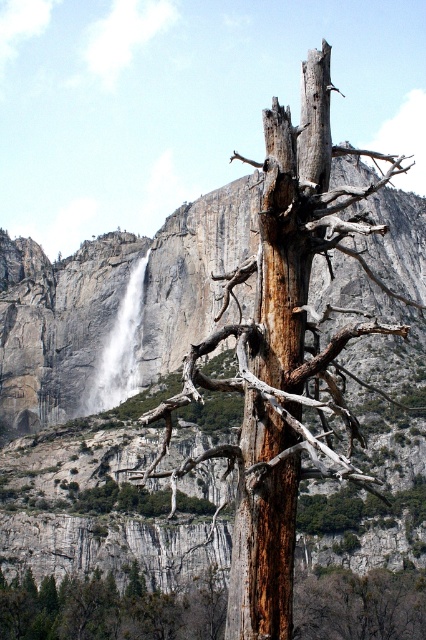
Looking at this image, is brown wood tree at center below smooth gray rock at center?

No.

Is point (328, 307) in front of point (379, 268)?

That is True.

Between point (322, 451) and point (17, 273), which one is positioned behind?

Positioned behind is point (17, 273).

This screenshot has width=426, height=640. I want to click on brown wood tree at center, so click(284, 355).

Does brown wood tree at center appear under brown rough bark tree at center?

No, brown wood tree at center is not below brown rough bark tree at center.

Between brown wood tree at center and brown rough bark tree at center, which one appears on the left side from the viewer's perspective?

Positioned to the left is brown rough bark tree at center.

Where is `brown wood tree at center`? The width and height of the screenshot is (426, 640). brown wood tree at center is located at coordinates (284, 355).

Does smooth gray rock at center appear on the left side of white textured waterfall at center?

Yes, smooth gray rock at center is to the left of white textured waterfall at center.

Does smooth gray rock at center come in front of white textured waterfall at center?

Yes, it is in front of white textured waterfall at center.

Find the location of a particular element. This screenshot has height=640, width=426. smooth gray rock at center is located at coordinates (112, 301).